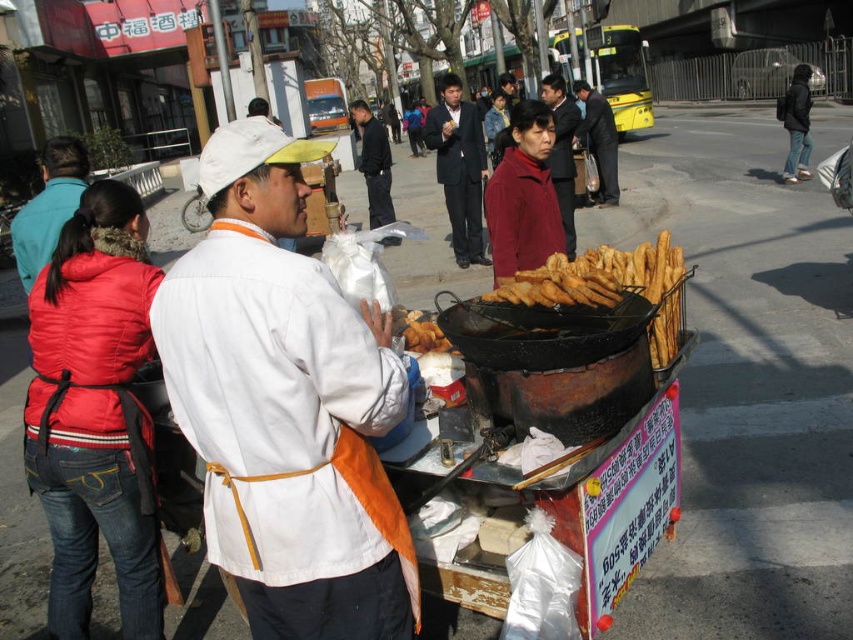
You are standing in front of the food cart and want to grab the item at point (540,234) and the item at point (602,168). Which item should you reach for first to avoid burning your hand?

You should reach for the item at point (540,234) first because it is closer to you than the item at point (602,168), so it is safer to grab the closer one first to avoid burning your hand.